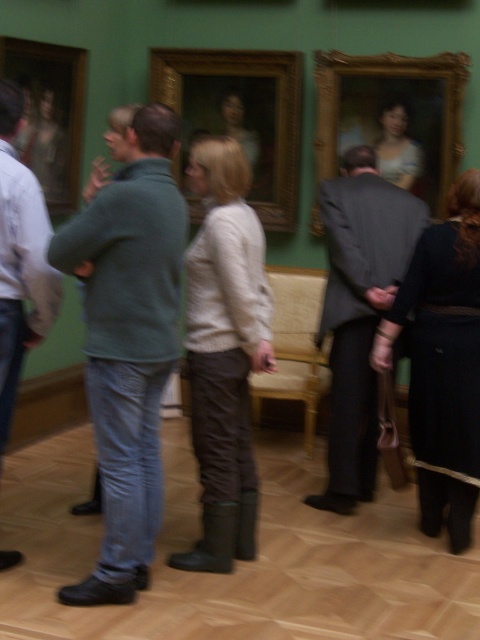
Is wooden framed portrait at center further to the viewer compared to wooden frame at left?

Yes, it is.

Who is lower down, wooden framed portrait at center or wooden frame at left?

Positioned lower is wooden frame at left.

What do you see at coordinates (239, 116) in the screenshot? The height and width of the screenshot is (640, 480). I see `wooden framed portrait at center` at bounding box center [239, 116].

Find the location of `wooden framed portrait at center`. wooden framed portrait at center is located at coordinates (239, 116).

Can you confirm if black leather dress at lower right is thinner than wooden frame at left?

No.

Does point (400, 317) lie in front of point (76, 93)?

Yes, it is.

Between point (455, 291) and point (78, 113), which one is positioned behind?

The point (78, 113) is more distant.

I want to click on black leather dress at lower right, so click(443, 362).

Is point (447, 275) farther from camera compared to point (195, 74)?

No, (447, 275) is closer to viewer.

Which is in front, point (478, 467) or point (229, 51)?

Positioned in front is point (478, 467).

The image size is (480, 640). I want to click on black leather dress at lower right, so click(x=443, y=362).